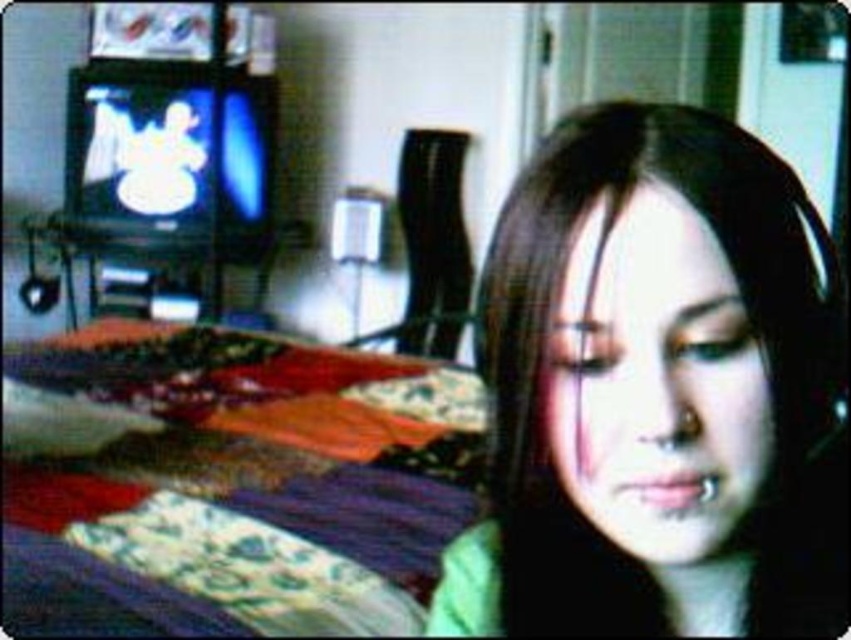
Question: Does matte green shirt at center have a larger size compared to multicolored fabric bed at lower left?

Choices:
 (A) yes
 (B) no

Answer: (B)

Question: Does matte green shirt at center lie behind multicolored fabric bed at lower left?

Choices:
 (A) no
 (B) yes

Answer: (A)

Question: Which of the following is the farthest from the observer?

Choices:
 (A) (250, 346)
 (B) (730, 150)

Answer: (A)

Question: Which of the following is the farthest from the observer?

Choices:
 (A) (67, 385)
 (B) (667, 598)

Answer: (A)

Question: Does matte green shirt at center come behind multicolored fabric bed at lower left?

Choices:
 (A) yes
 (B) no

Answer: (B)